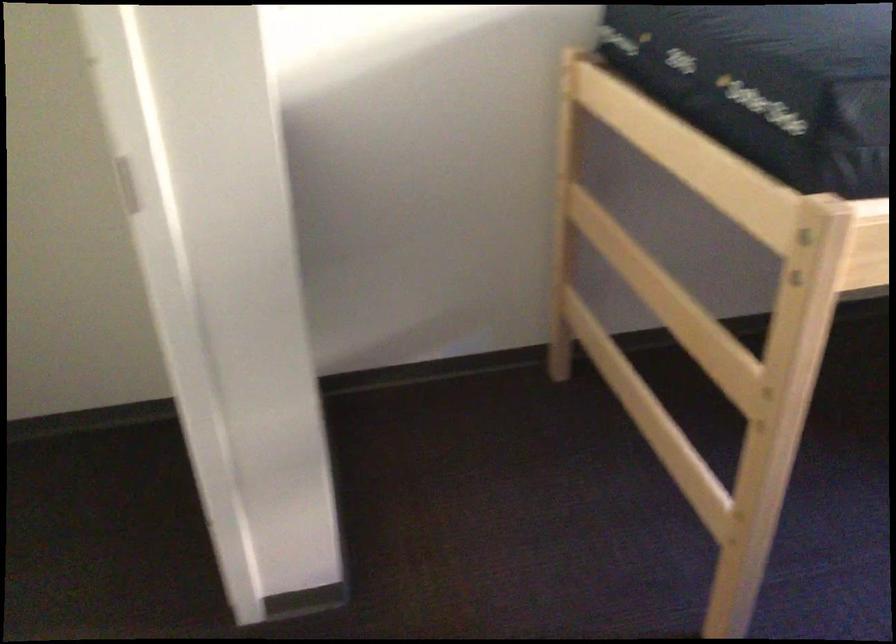
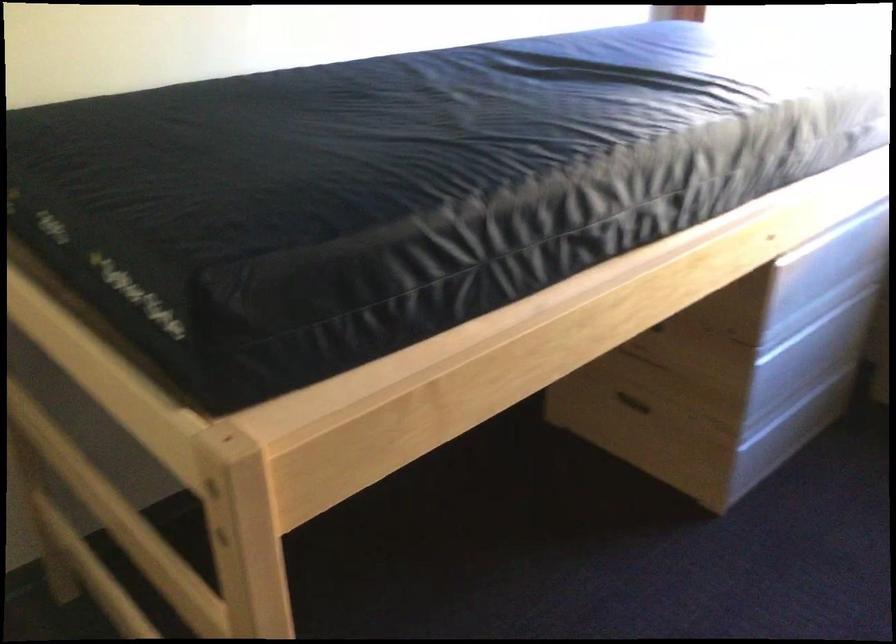
Question: Based on the continuous images, in which direction is the camera rotating? Reply with the corresponding letter.

Choices:
 (A) Left
 (B) Right
 (C) Up
 (D) Down

Answer: (B)